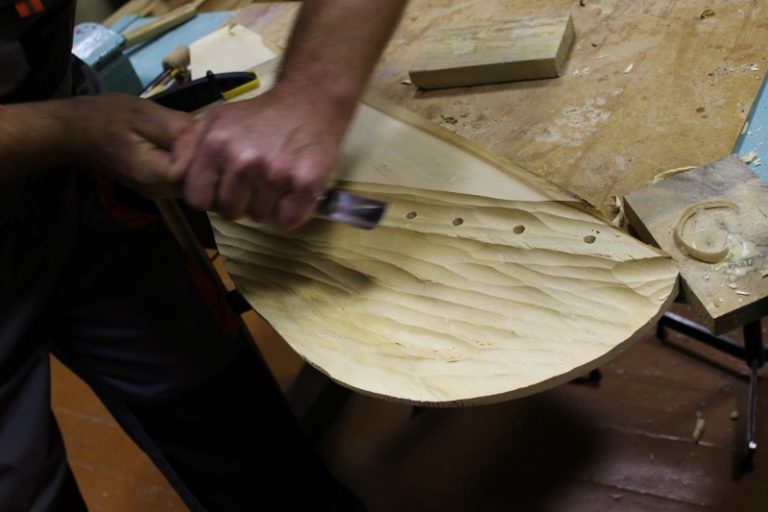
This screenshot has height=512, width=768. Identify the location of board. (442, 385).